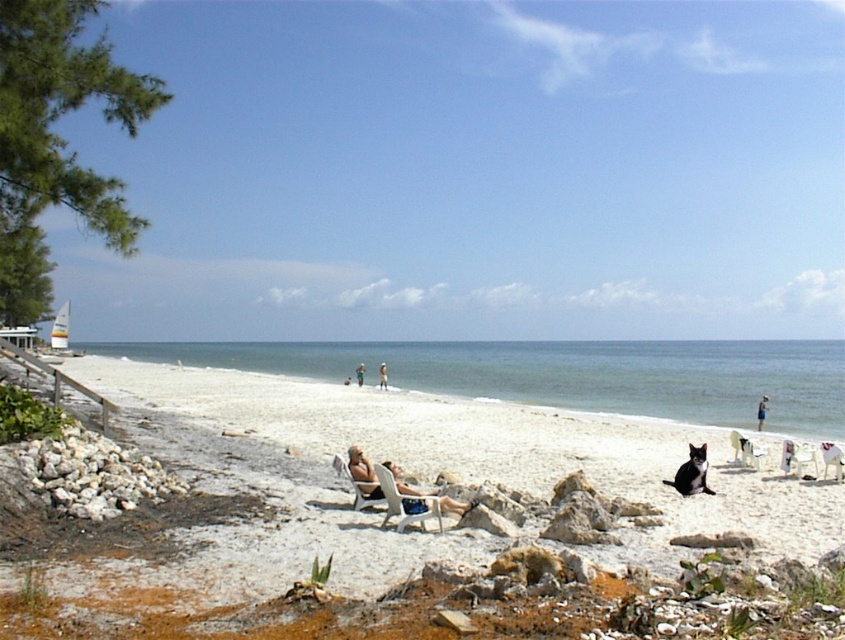
Which is behind, point (805, 547) or point (832, 353)?

The point (832, 353) is behind.

Is white sand beach at center shorter than white sand beach at lower center?

Yes, white sand beach at center is shorter than white sand beach at lower center.

Which is behind, point (48, 602) or point (814, 392)?

Point (814, 392)

I want to click on white sand beach at center, so click(417, 524).

Is white sand beach at center above matte black lounge chair at center?

No.

Does white sand beach at center come in front of matte black lounge chair at center?

Yes, white sand beach at center is closer to the viewer.

Is point (368, 534) closer to viewer compared to point (428, 502)?

Yes, point (368, 534) is in front of point (428, 502).

Locate an element on the screen. white sand beach at center is located at coordinates (417, 524).

How far apart are metallic silver chair at lower center and light brown wooden chair at center?

metallic silver chair at lower center is 38.06 meters from light brown wooden chair at center.

Measure the distance between point (339, 468) and camera.

Point (339, 468) is 11.97 meters from camera.

Identify the location of metallic silver chair at lower center. This screenshot has width=845, height=640. click(x=353, y=484).